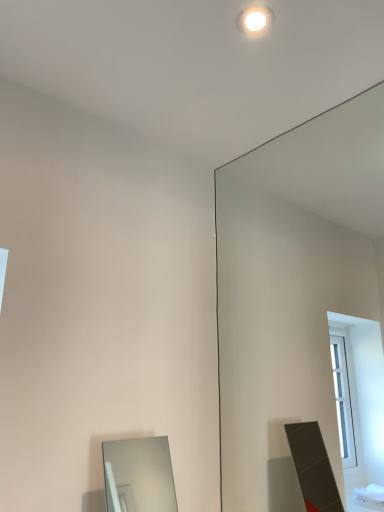
Question: Does clear glass mirror at upper right, which ranks as the first mirror in right-to-left order, appear on the left side of white glossy light fixture at upper center?

Choices:
 (A) yes
 (B) no

Answer: (B)

Question: From a real-world perspective, is clear glass mirror at upper right, the 2th mirror from the left, positioned under white glossy light fixture at upper center based on gravity?

Choices:
 (A) yes
 (B) no

Answer: (A)

Question: Is clear glass mirror at upper right, which ranks as the first mirror in right-to-left order, bigger than white glossy light fixture at upper center?

Choices:
 (A) no
 (B) yes

Answer: (B)

Question: Considering the relative positions of clear glass mirror at upper right, the 2th mirror from the left, and white glossy light fixture at upper center in the image provided, is clear glass mirror at upper right, the 2th mirror from the left, in front of white glossy light fixture at upper center?

Choices:
 (A) yes
 (B) no

Answer: (A)

Question: Is clear glass mirror at upper right, which ranks as the first mirror in right-to-left order, shorter than white glossy light fixture at upper center?

Choices:
 (A) yes
 (B) no

Answer: (B)

Question: Visually, is smooth silver mirror at lower left, arranged as the 1th mirror when viewed from the left, positioned to the left or to the right of white glossy light fixture at upper center?

Choices:
 (A) right
 (B) left

Answer: (B)

Question: In terms of height, does smooth silver mirror at lower left, acting as the 2th mirror starting from the right, look taller or shorter compared to white glossy light fixture at upper center?

Choices:
 (A) short
 (B) tall

Answer: (B)

Question: From the image's perspective, is smooth silver mirror at lower left, arranged as the 1th mirror when viewed from the left, positioned above or below white glossy light fixture at upper center?

Choices:
 (A) above
 (B) below

Answer: (B)

Question: Is point (114, 501) closer or farther from the camera than point (241, 14)?

Choices:
 (A) closer
 (B) farther

Answer: (B)

Question: From a real-world perspective, is smooth silver mirror at lower left, acting as the 2th mirror starting from the right, above or below clear glass mirror at upper right, the 2th mirror from the left?

Choices:
 (A) below
 (B) above

Answer: (A)

Question: Considering the positions of smooth silver mirror at lower left, acting as the 2th mirror starting from the right, and clear glass mirror at upper right, which ranks as the first mirror in right-to-left order, in the image, is smooth silver mirror at lower left, acting as the 2th mirror starting from the right, taller or shorter than clear glass mirror at upper right, which ranks as the first mirror in right-to-left order,?

Choices:
 (A) short
 (B) tall

Answer: (A)

Question: In the image, is smooth silver mirror at lower left, acting as the 2th mirror starting from the right, positioned in front of or behind clear glass mirror at upper right, which ranks as the first mirror in right-to-left order?

Choices:
 (A) front
 (B) behind

Answer: (B)

Question: From the image's perspective, is smooth silver mirror at lower left, arranged as the 1th mirror when viewed from the left, positioned above or below clear glass mirror at upper right, the 2th mirror from the left?

Choices:
 (A) above
 (B) below

Answer: (B)

Question: In terms of width, does clear glass mirror at upper right, the 2th mirror from the left, look wider or thinner when compared to smooth silver mirror at lower left, acting as the 2th mirror starting from the right?

Choices:
 (A) wide
 (B) thin

Answer: (B)

Question: From a real-world perspective, is clear glass mirror at upper right, the 2th mirror from the left, above or below smooth silver mirror at lower left, arranged as the 1th mirror when viewed from the left?

Choices:
 (A) below
 (B) above

Answer: (B)